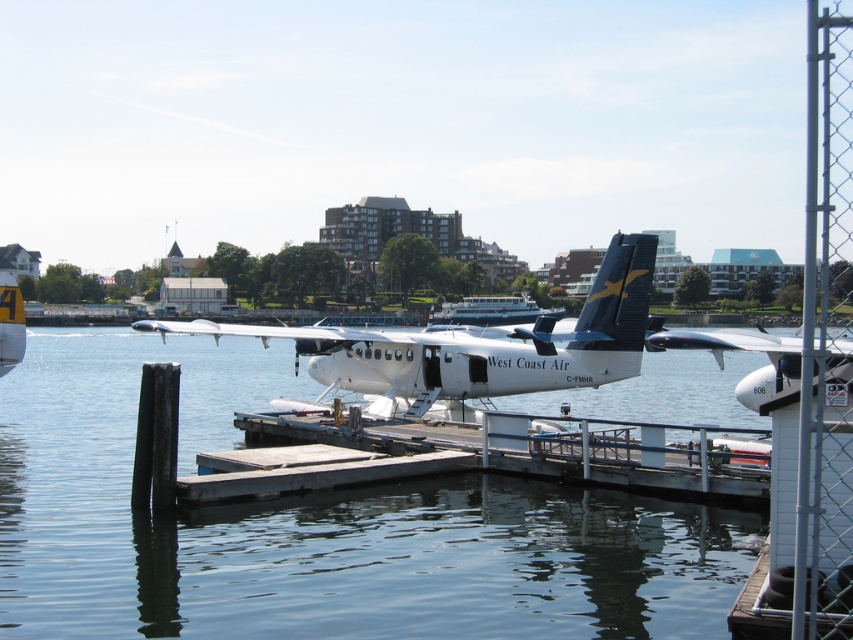
Question: Does clear water at dock center appear on the left side of white matte airplane at center?

Choices:
 (A) no
 (B) yes

Answer: (B)

Question: Which of the following is the farthest from the observer?

Choices:
 (A) (467, 304)
 (B) (628, 285)

Answer: (A)

Question: Can you confirm if white matte airplane at center is positioned below white matte seaplane at center?

Choices:
 (A) yes
 (B) no

Answer: (B)

Question: Which of the following is the closest to the observer?

Choices:
 (A) white matte seaplane at center
 (B) clear water at dock center
 (C) white matte airplane at center

Answer: (A)

Question: Estimate the real-world distances between objects in this image. Which object is farther from the white matte seaplane at center?

Choices:
 (A) white glossy boat at center
 (B) white matte airplane at center
 (C) clear water at dock center

Answer: (A)

Question: Is white matte airplane at center bigger than white matte seaplane at center?

Choices:
 (A) yes
 (B) no

Answer: (B)